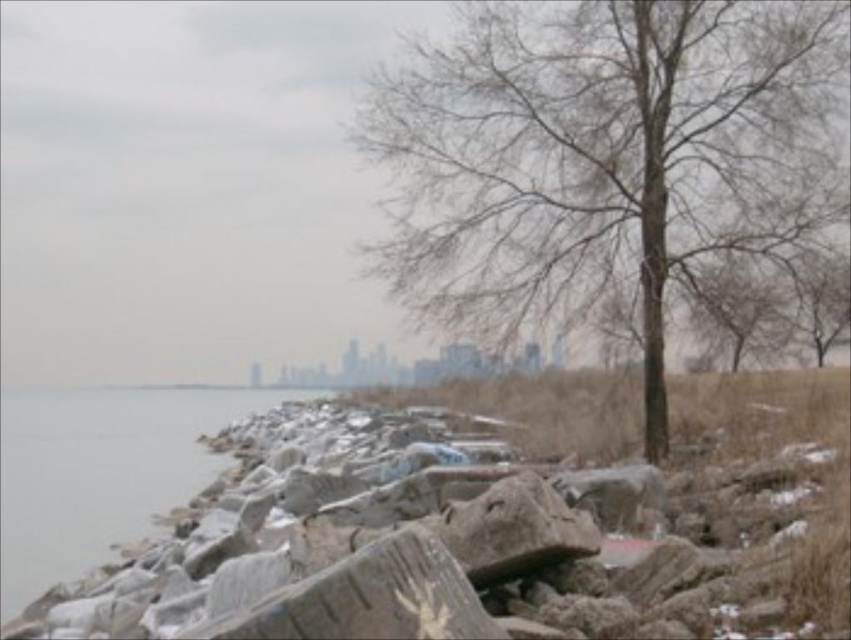
Which is below, bare wood tree at center or gray stone water at left?

Positioned lower is gray stone water at left.

Which is behind, point (415, 189) or point (89, 432)?

Point (89, 432)

Where is `bare wood tree at center`? This screenshot has width=851, height=640. bare wood tree at center is located at coordinates (603, 156).

Between gray stone rocks at lower left and bare wood tree at center, which one has more height?

With more height is bare wood tree at center.

Does gray stone rocks at lower left appear under bare wood tree at center?

Yes.

This screenshot has height=640, width=851. Identify the location of gray stone rocks at lower left. (466, 541).

Identify the location of gray stone rocks at lower left. The width and height of the screenshot is (851, 640). (466, 541).

Does point (527, 572) come closer to viewer compared to point (140, 435)?

Yes, it is in front of point (140, 435).

At what (x,y) coordinates should I click in order to perform the action: click on gray stone rocks at lower left. Please return your answer as a coordinate pair (x, y). Looking at the image, I should click on click(466, 541).